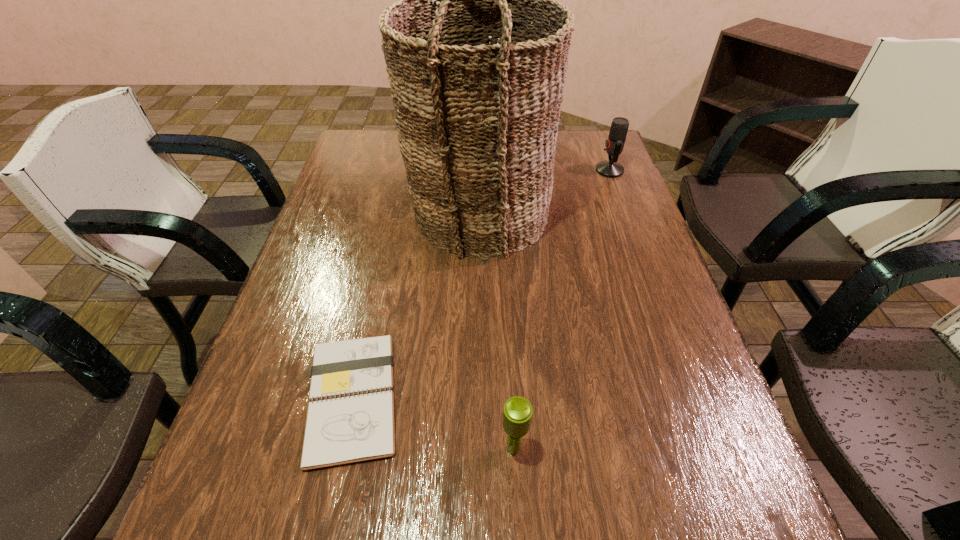
Where is `vacant space that's between the rightmost object and the notepad`? This screenshot has width=960, height=540. vacant space that's between the rightmost object and the notepad is located at coordinates (481, 284).

This screenshot has height=540, width=960. What are the coordinates of `free space that is in between the right microphone and the left microphone` in the screenshot? It's located at (562, 310).

This screenshot has width=960, height=540. Find the location of `free space between the right microphone and the nearer microphone`. free space between the right microphone and the nearer microphone is located at coordinates (562, 310).

Find the location of a particular element. The width and height of the screenshot is (960, 540). free space between the shortest object and the tallest object is located at coordinates (415, 305).

Where is `vacant area between the tallest object and the left microphone`? vacant area between the tallest object and the left microphone is located at coordinates click(x=496, y=332).

Where is `vacant area that lies between the notepad and the nearer microphone`? Image resolution: width=960 pixels, height=540 pixels. vacant area that lies between the notepad and the nearer microphone is located at coordinates (433, 423).

Identify the location of vacant area that lies between the nearer microphone and the basket. This screenshot has width=960, height=540. (496, 332).

At what (x,y) coordinates should I click in order to perform the action: click on free space between the nearer microphone and the farther microphone. Please return your answer as a coordinate pair (x, y). This screenshot has width=960, height=540. Looking at the image, I should click on (562, 310).

The image size is (960, 540). I want to click on object that is the nearest to the notepad, so click(517, 414).

Identify the location of object that is the closest one to the rightmost object. (477, 122).